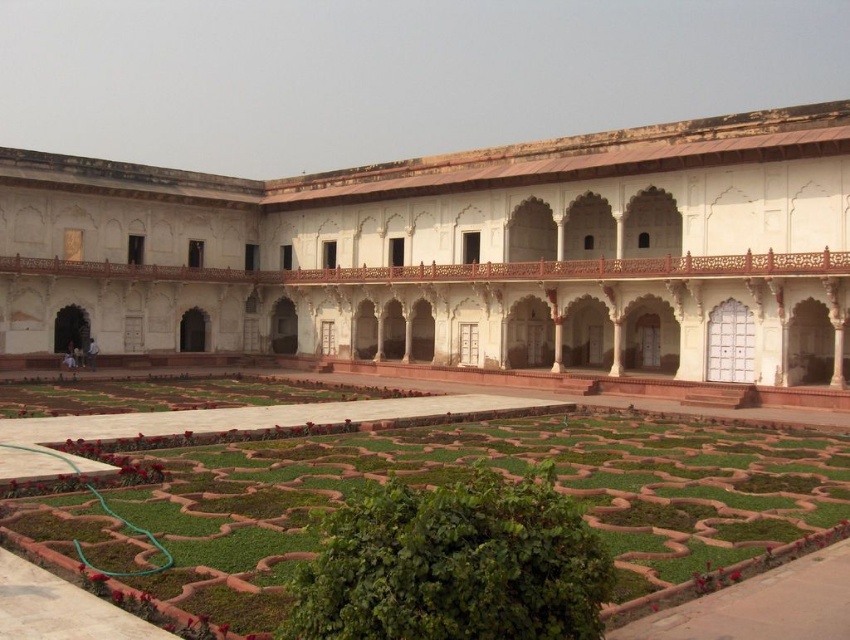
Does white marble palace at center have a greater height compared to green grass at center?

Yes.

Between white marble palace at center and green grass at center, which one has more height?

With more height is white marble palace at center.

At what (x,y) coordinates should I click in order to perform the action: click on white marble palace at center. Please return your answer as a coordinate pair (x, y). Looking at the image, I should click on (463, 253).